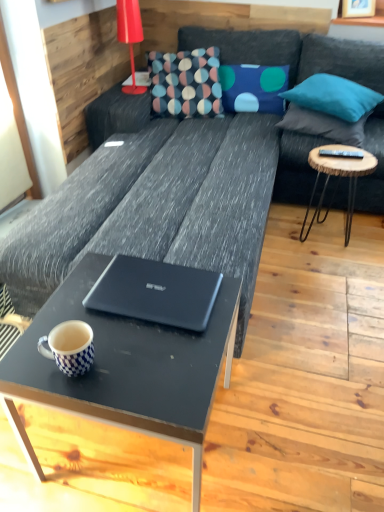
I want to click on free spot above matte black laptop at center (from a real-world perspective), so click(x=158, y=286).